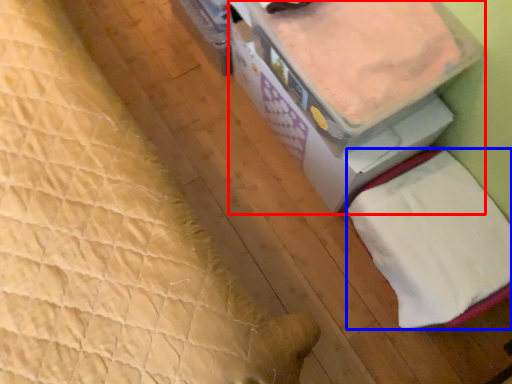
Question: Which object appears closest to the camera in this image, storage box (highlighted by a red box) or sheet (highlighted by a blue box)?

Choices:
 (A) storage box
 (B) sheet

Answer: (A)